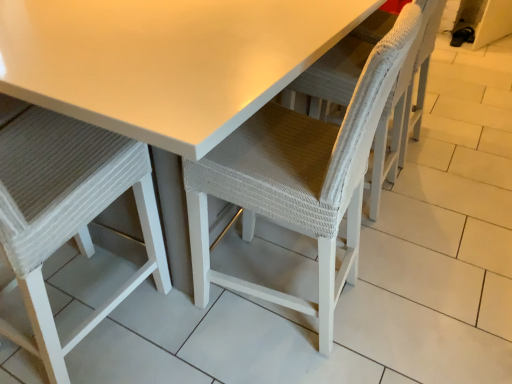
Question: Is white matte table at center positioned beyond the bounds of white woven chair at left, which is counted as the 2th chair, starting from the right?

Choices:
 (A) yes
 (B) no

Answer: (A)

Question: From the image's perspective, does white matte table at center appear higher than white woven chair at left, which is counted as the 2th chair, starting from the right?

Choices:
 (A) no
 (B) yes

Answer: (B)

Question: Is white matte table at center in front of white woven chair at left, which is counted as the 2th chair, starting from the right?

Choices:
 (A) yes
 (B) no

Answer: (B)

Question: Can you confirm if white matte table at center is bigger than white woven chair at left, which is counted as the 2th chair, starting from the right?

Choices:
 (A) yes
 (B) no

Answer: (A)

Question: Is white matte table at center to the right of white woven chair at left, placed as the first chair when sorted from left to right, from the viewer's perspective?

Choices:
 (A) yes
 (B) no

Answer: (A)

Question: In the image, is white woven chair at left, placed as the first chair when sorted from left to right, on the left side or the right side of white matte table at center?

Choices:
 (A) right
 (B) left

Answer: (B)

Question: From a real-world perspective, relative to white matte table at center, is white woven chair at left, which is counted as the 2th chair, starting from the right, vertically above or below?

Choices:
 (A) below
 (B) above

Answer: (B)

Question: Would you say white woven chair at left, placed as the first chair when sorted from left to right, is inside or outside white matte table at center?

Choices:
 (A) inside
 (B) outside

Answer: (A)

Question: Does point pos(157,233) appear closer or farther from the camera than point pos(192,26)?

Choices:
 (A) closer
 (B) farther

Answer: (B)

Question: From a real-world perspective, relative to white matte table at center, is white woven chair at center, the 2th chair viewed from the left, vertically above or below?

Choices:
 (A) below
 (B) above

Answer: (B)

Question: Is point (368, 89) positioned closer to the camera than point (150, 79)?

Choices:
 (A) farther
 (B) closer

Answer: (B)

Question: Is white woven chair at center, the 2th chair viewed from the left, spatially inside white matte table at center, or outside of it?

Choices:
 (A) outside
 (B) inside

Answer: (B)

Question: In terms of size, does white woven chair at center, the 2th chair viewed from the left, appear bigger or smaller than white matte table at center?

Choices:
 (A) small
 (B) big

Answer: (A)

Question: From the image's perspective, relative to white woven chair at center, acting as the first chair starting from the right, is white woven chair at left, placed as the first chair when sorted from left to right, above or below?

Choices:
 (A) above
 (B) below

Answer: (B)

Question: Looking at the image, does white woven chair at left, which is counted as the 2th chair, starting from the right, seem bigger or smaller compared to white woven chair at center, the 2th chair viewed from the left?

Choices:
 (A) small
 (B) big

Answer: (A)